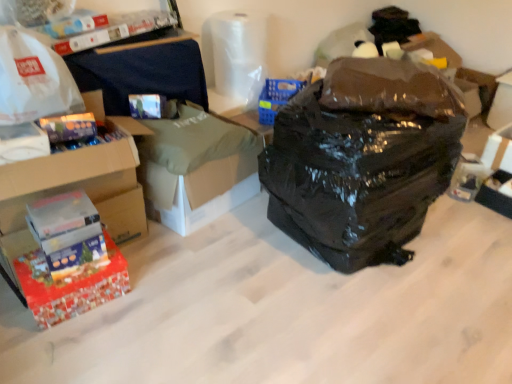
I want to click on free spot in front of white cardboard box at center, so click(207, 266).